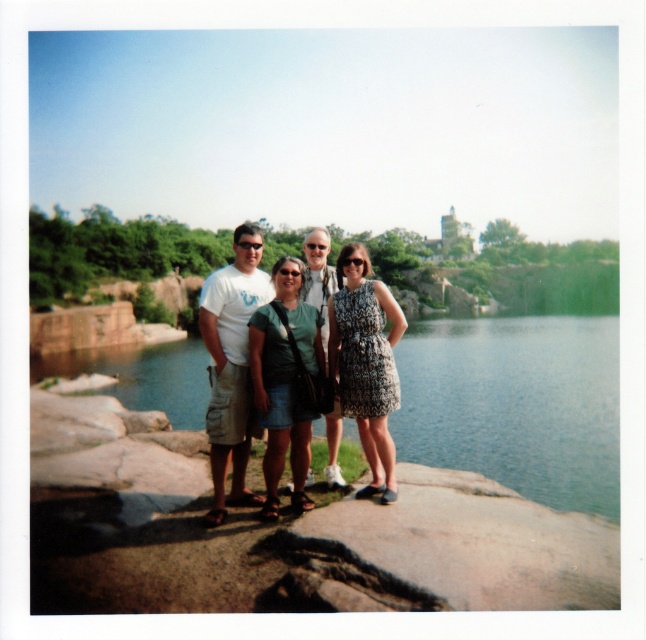
In the scene shown: You are a photographer trying to capture a group photo where the green water at lower center and the light gray fabric shirt at center are both visible. Based on their heights, which object will appear closer to the bottom of the photo?

The green water at lower center has a lesser height compared to the light gray fabric shirt at center, so it will appear closer to the bottom of the photo.

You are standing at the point labeled as point (328, 244) and want to walk towards the point labeled as point (391, 444). According to the scene, will you be moving forward or backward relative to your current position?

Since point (391, 444) is in front of point (328, 244), moving towards it would mean you are moving forward relative to your current position at point (328, 244).

Consider the image. You are a photographer trying to arrange two dresses in a photo shoot. The scene has a patterned fabric dress at center and a green fabric dress at center. Which dress should you place in the foreground to ensure it appears larger in the photo?

The patterned fabric dress at center has a greater height compared to the green fabric dress at center, so placing the patterned fabric dress at center in the foreground will make it appear larger in the photo.